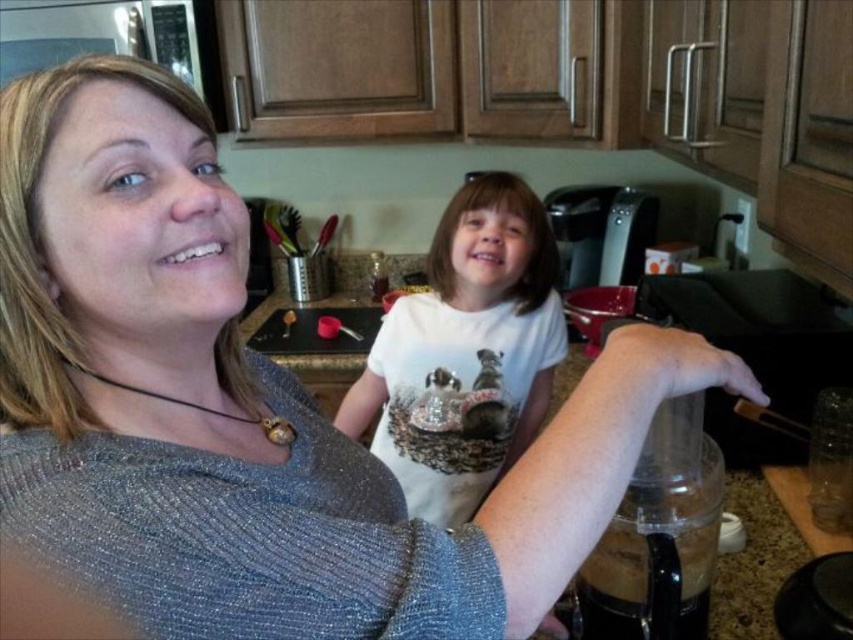
Is white cotton shirt at center wider than granite countertop at center?

No, white cotton shirt at center is not wider than granite countertop at center.

Between white cotton shirt at center and granite countertop at center, which one is positioned lower?

Positioned lower is white cotton shirt at center.

Is point (518, 307) positioned after point (822, 285)?

Yes.

Identify the location of white cotton shirt at center. (465, 353).